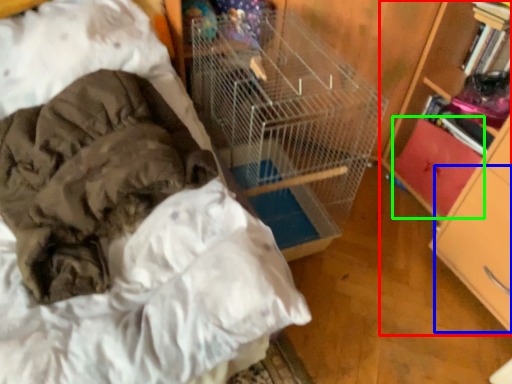
Question: Which object is the closest to the bookcase (highlighted by a red box)? Choose among these: drawer (highlighted by a blue box) or drawer (highlighted by a green box).

Choices:
 (A) drawer
 (B) drawer

Answer: (A)